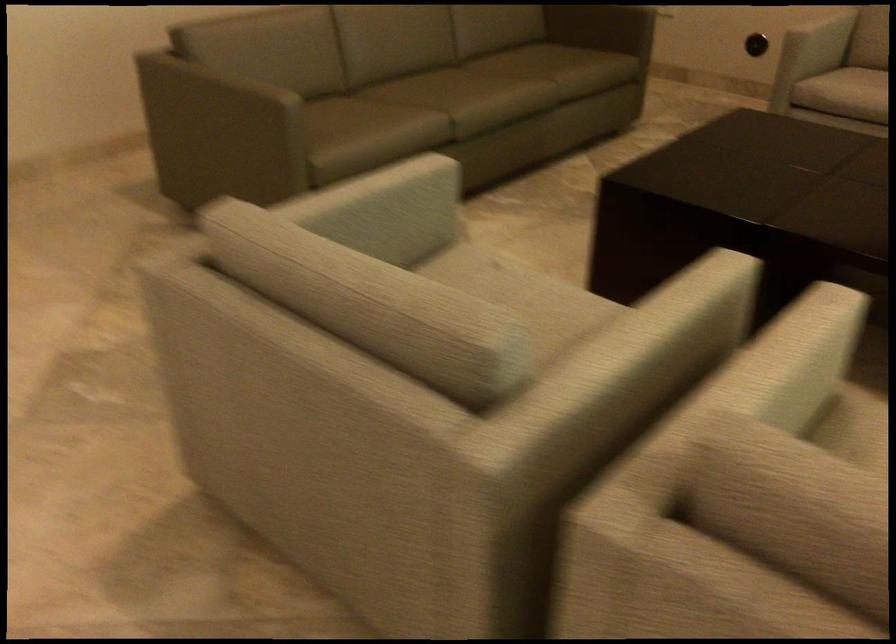
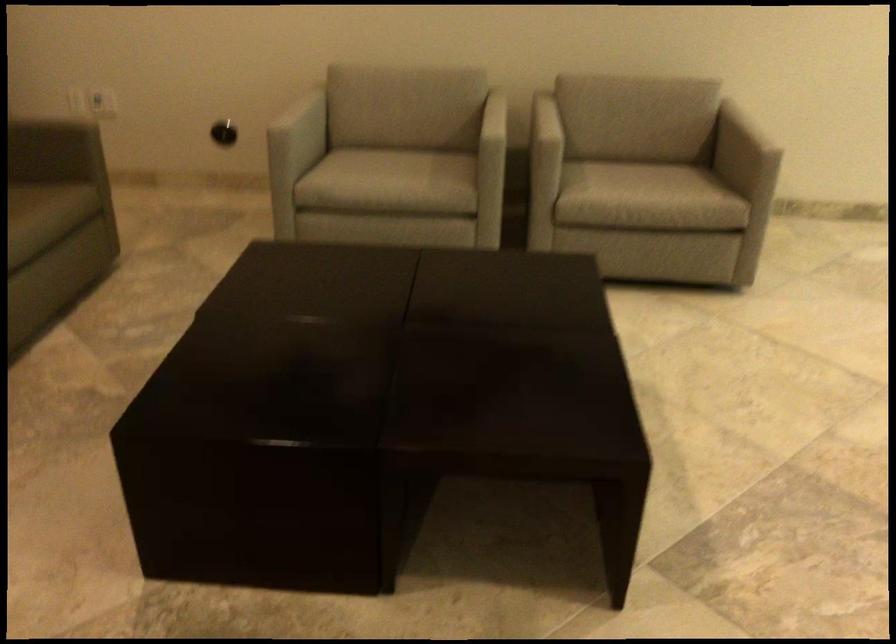
Find the pixel in the second image that matches (x=588, y=73) in the first image.

(36, 219)